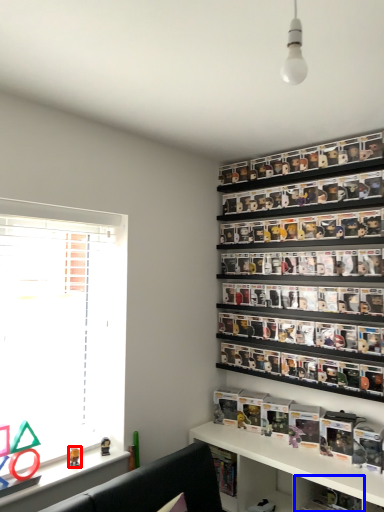
Question: Among these objects, which one is nearest to the camera, toy (highlighted by a red box) or cabinet (highlighted by a blue box)?

Choices:
 (A) toy
 (B) cabinet

Answer: (A)